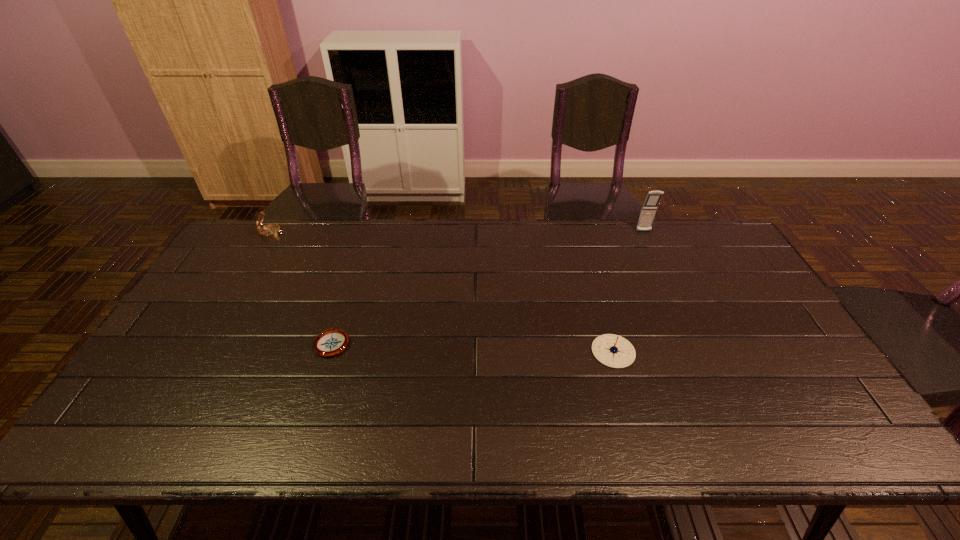
Identify the location of vacant area in the image that satisfies the following two spatial constraints: 1. with the dial facing the tallest compass; 2. on the right side of the shortest object. This screenshot has height=540, width=960. (208, 342).

I want to click on free point that satisfies the following two spatial constraints: 1. on the front-facing side of the rightmost object; 2. with the dial facing the leftmost object, so click(x=644, y=233).

Locate an element on the screen. Image resolution: width=960 pixels, height=540 pixels. free space that satisfies the following two spatial constraints: 1. with the dial facing the tallest compass; 2. on the back side of the second compass from right to left is located at coordinates (208, 342).

You are a GUI agent. You are given a task and a screenshot of the screen. Output one action in this format:
    pyautogui.click(x=<x>, y=<y>)
    Task: Click on the free spot that satisfies the following two spatial constraints: 1. with the dial facing the tallest compass; 2. on the left side of the second object from left to right
    
    Given the screenshot: What is the action you would take?
    pyautogui.click(x=208, y=342)